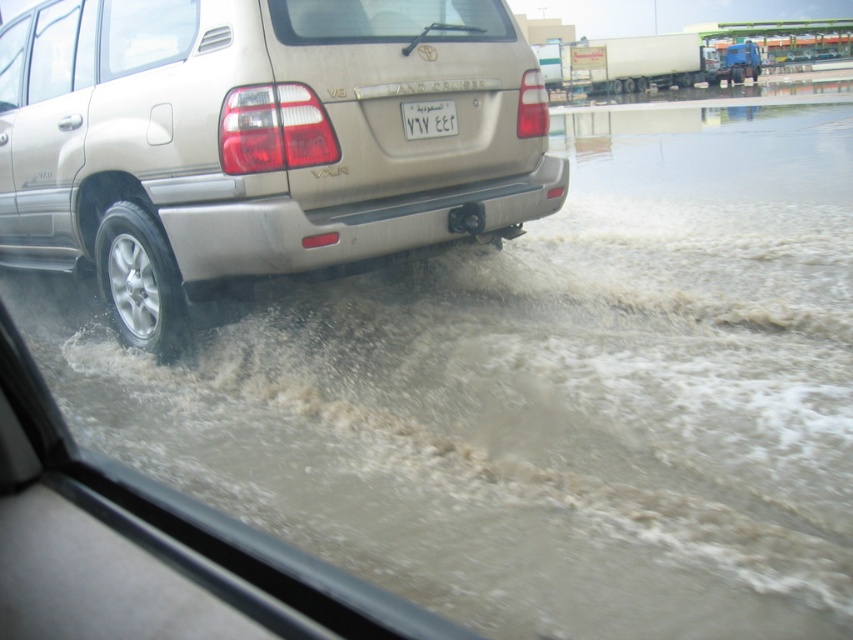
You are a traffic officer observing a flooded street scene. You notice a satin beige suv at center and a white plastic license plate at center. Which object is positioned higher in the image?

The white plastic license plate at center is positioned higher in the image than the satin beige suv at center.

You are a delivery driver trying to park your satin beige suv at center in a parking spot that can only accommodate vehicles narrower than the white plastic license plate at center. Can your vehicle fit in the parking spot?

The satin beige suv at center is wider than the white plastic license plate at center, so it cannot fit in the parking spot designed for narrower vehicles.